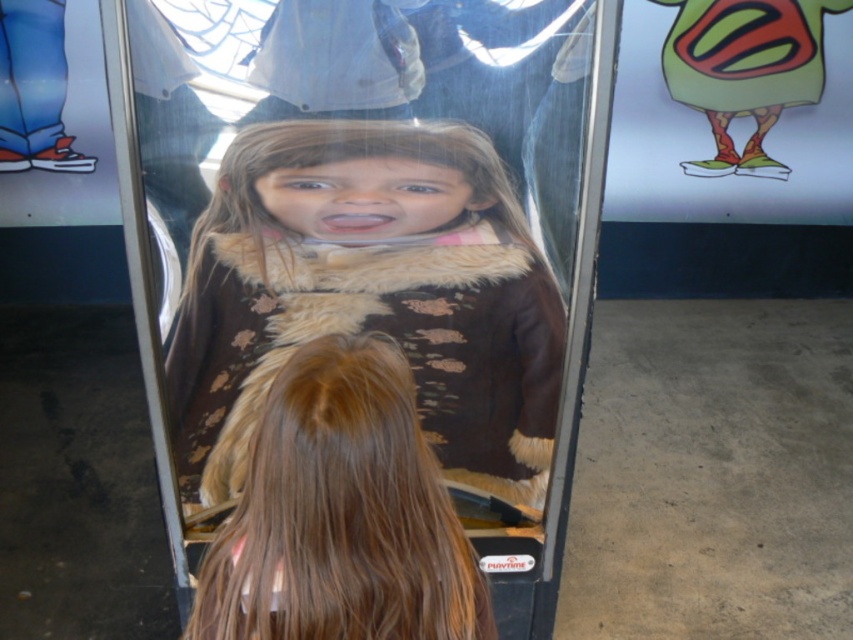
You are a fashion designer observing two coats displayed in an interactive mirror exhibit. The coats are labeled as the brown fuzzy coat at center and the smooth brown coat at center. Which coat is positioned higher on the mirror display?

The brown fuzzy coat at center is located above the smooth brown coat at center, so it is positioned higher on the mirror display.

You are a child trying to reach the transparent plastic glass at center to drink water. The smooth brown coat at center is in your way. Can you move the coat to get the glass?

The transparent plastic glass at center is above the smooth brown coat at center, so you can reach the glass without moving the coat by simply reaching upwards.

You are a tailor measuring two coats for a customer. The coats are the brown fuzzy coat at center and the smooth brown coat at center. The customer wants to know if they can fit both coats in a storage box that is 24 inches long. Can you confirm if both coats will fit side by side in the box?

The brown fuzzy coat at center and smooth brown coat at center are 22.90 inches apart, so they can fit side by side in a 24 inch storage box since the total space needed is less than the box length.